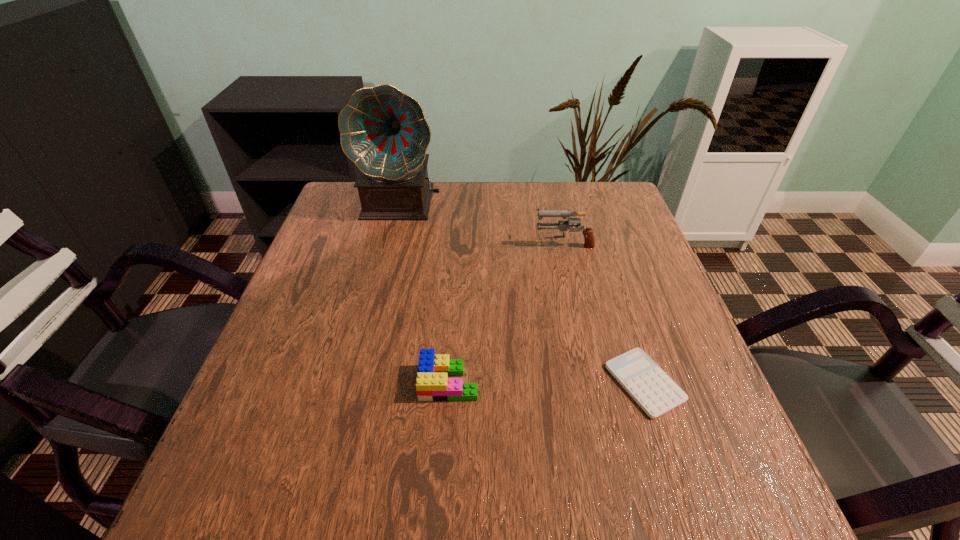
Where is `free space located at the barrel end of the third shortest object`? The width and height of the screenshot is (960, 540). free space located at the barrel end of the third shortest object is located at coordinates (438, 244).

The height and width of the screenshot is (540, 960). I want to click on free region located on the right of the Lego, so point(510,382).

Find the location of `free location located 0.080m on the back of the shortest object`. free location located 0.080m on the back of the shortest object is located at coordinates (624, 321).

What are the coordinates of `object that is at the far edge` in the screenshot? It's located at (383, 131).

Identify the location of object that is at the left edge. Image resolution: width=960 pixels, height=540 pixels. (383, 131).

This screenshot has height=540, width=960. What are the coordinates of `gun that is at the right edge` in the screenshot? It's located at coord(589,239).

At what (x,y) coordinates should I click in order to perform the action: click on calculator positioned at the right edge. Please return your answer as a coordinate pair (x, y). The height and width of the screenshot is (540, 960). Looking at the image, I should click on (653, 390).

At what (x,y) coordinates should I click in order to perform the action: click on object located in the far left corner section of the desktop. Please return your answer as a coordinate pair (x, y). Looking at the image, I should click on (383, 131).

Find the location of a particular element. The image size is (960, 540). free location at the far edge is located at coordinates (564, 207).

The image size is (960, 540). In the image, there is a desktop. In order to click on vacant area at the near edge in this screenshot , I will do [x=619, y=505].